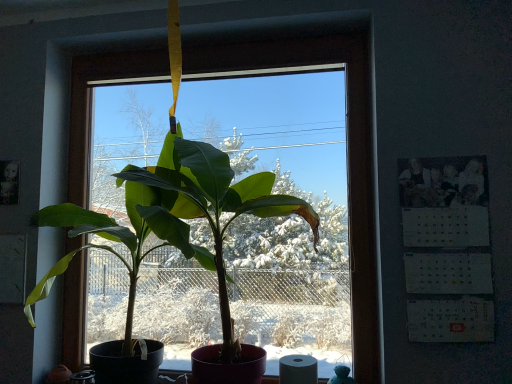
Question: Does white paper calendar at right appear on the right side of white matte toilet paper at lower center?

Choices:
 (A) no
 (B) yes

Answer: (B)

Question: Does white paper calendar at right lie in front of white matte toilet paper at lower center?

Choices:
 (A) yes
 (B) no

Answer: (A)

Question: Is white paper calendar at right to the left of white matte toilet paper at lower center from the viewer's perspective?

Choices:
 (A) no
 (B) yes

Answer: (A)

Question: Is white paper calendar at right wider than white matte toilet paper at lower center?

Choices:
 (A) no
 (B) yes

Answer: (A)

Question: Can you confirm if white paper calendar at right is shorter than white matte toilet paper at lower center?

Choices:
 (A) no
 (B) yes

Answer: (A)

Question: Is white paper calendar at right inside or outside of green matte plant at center?

Choices:
 (A) inside
 (B) outside

Answer: (B)

Question: Based on their positions, is white paper calendar at right located to the left or right of green matte plant at center?

Choices:
 (A) left
 (B) right

Answer: (B)

Question: From a real-world perspective, is white paper calendar at right physically located above or below green matte plant at center?

Choices:
 (A) below
 (B) above

Answer: (B)

Question: From the image's perspective, is white paper calendar at right above or below green matte plant at center?

Choices:
 (A) above
 (B) below

Answer: (A)

Question: Is point (315, 370) positioned closer to the camera than point (446, 294)?

Choices:
 (A) closer
 (B) farther

Answer: (B)

Question: Would you say white matte toilet paper at lower center is inside or outside white paper calendar at right?

Choices:
 (A) inside
 (B) outside

Answer: (B)

Question: From a real-world perspective, relative to white paper calendar at right, is white matte toilet paper at lower center vertically above or below?

Choices:
 (A) below
 (B) above

Answer: (A)

Question: In terms of width, does white matte toilet paper at lower center look wider or thinner when compared to white paper calendar at right?

Choices:
 (A) wide
 (B) thin

Answer: (A)

Question: From the image's perspective, is white paper calendar at right located above or below white matte toilet paper at lower center?

Choices:
 (A) above
 (B) below

Answer: (A)

Question: Is white paper calendar at right taller or shorter than white matte toilet paper at lower center?

Choices:
 (A) tall
 (B) short

Answer: (A)